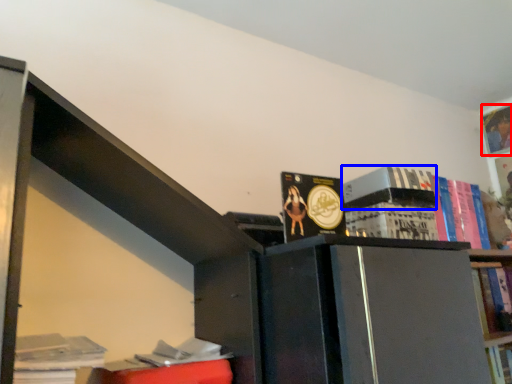
Question: Among these objects, which one is nearest to the camera, book (highlighted by a red box) or paperback book (highlighted by a blue box)?

Choices:
 (A) book
 (B) paperback book

Answer: (B)